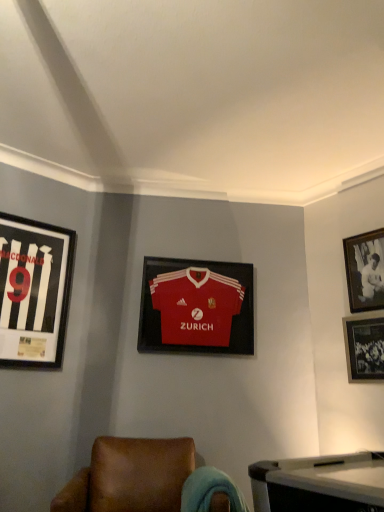
Question: Is brown leather chair at lower center taller than black glossy photo frame at upper right, placed as the first picture frame when sorted from right to left?

Choices:
 (A) no
 (B) yes

Answer: (A)

Question: Would you say brown leather chair at lower center is a long distance from black glossy photo frame at upper right, the 4th picture frame from the left?

Choices:
 (A) yes
 (B) no

Answer: (A)

Question: From the image's perspective, is brown leather chair at lower center located beneath black glossy photo frame at upper right, placed as the first picture frame when sorted from right to left?

Choices:
 (A) yes
 (B) no

Answer: (A)

Question: Does brown leather chair at lower center appear on the right side of black glossy photo frame at upper right, placed as the first picture frame when sorted from right to left?

Choices:
 (A) yes
 (B) no

Answer: (B)

Question: From a real-world perspective, is brown leather chair at lower center positioned over black glossy photo frame at upper right, placed as the first picture frame when sorted from right to left, based on gravity?

Choices:
 (A) yes
 (B) no

Answer: (B)

Question: Is black matte jersey at left, acting as the fourth picture frame starting from the right, taller or shorter than brown leather chair at lower center?

Choices:
 (A) tall
 (B) short

Answer: (A)

Question: Considering the positions of point (34, 348) and point (59, 493), is point (34, 348) closer or farther from the camera than point (59, 493)?

Choices:
 (A) closer
 (B) farther

Answer: (B)

Question: Is black matte jersey at left, acting as the fourth picture frame starting from the right, wider or thinner than brown leather chair at lower center?

Choices:
 (A) thin
 (B) wide

Answer: (A)

Question: Considering the positions of black matte jersey at left, acting as the fourth picture frame starting from the right, and brown leather chair at lower center in the image, is black matte jersey at left, acting as the fourth picture frame starting from the right, bigger or smaller than brown leather chair at lower center?

Choices:
 (A) big
 (B) small

Answer: (B)

Question: Is point (145, 451) positioned closer to the camera than point (367, 251)?

Choices:
 (A) farther
 (B) closer

Answer: (B)

Question: Considering the positions of brown leather chair at lower center and black glossy photo frame at upper right, the 4th picture frame from the left, in the image, is brown leather chair at lower center bigger or smaller than black glossy photo frame at upper right, the 4th picture frame from the left,?

Choices:
 (A) big
 (B) small

Answer: (A)

Question: In the image, is brown leather chair at lower center positioned in front of or behind black glossy photo frame at upper right, placed as the first picture frame when sorted from right to left?

Choices:
 (A) behind
 (B) front

Answer: (B)

Question: Is brown leather chair at lower center inside the boundaries of black glossy photo frame at upper right, the 4th picture frame from the left, or outside?

Choices:
 (A) inside
 (B) outside

Answer: (B)

Question: Is black glossy photo frame at upper right, placed as the first picture frame when sorted from right to left, spatially inside black glossy photo frame at lower right, the 2th picture frame in the right-to-left sequence, or outside of it?

Choices:
 (A) outside
 (B) inside

Answer: (A)

Question: Based on their positions, is black glossy photo frame at upper right, the 4th picture frame from the left, located to the left or right of black glossy photo frame at lower right, which appears as the 3th picture frame when viewed from the left?

Choices:
 (A) right
 (B) left

Answer: (A)